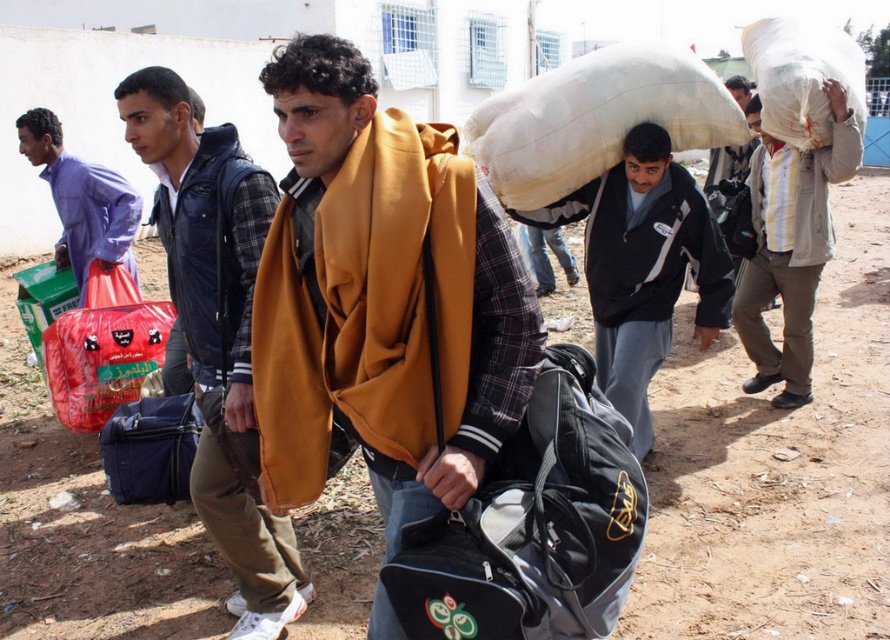
Who is higher up, black fabric bag at center or red plastic bag at center?

red plastic bag at center

Where is `black fabric bag at center`? This screenshot has width=890, height=640. black fabric bag at center is located at coordinates (534, 525).

Locate an element on the screen. The image size is (890, 640). black fabric bag at center is located at coordinates (534, 525).

Does matte yellow jacket at center have a lesser width compared to brushed metal bag at left?

Yes.

Between point (236, 253) and point (85, 227), which one is positioned behind?

The point (85, 227) is more distant.

This screenshot has width=890, height=640. Identify the location of matte yellow jacket at center. (217, 330).

Image resolution: width=890 pixels, height=640 pixels. Find the location of `black fabric bag at center`. black fabric bag at center is located at coordinates (534, 525).

Is point (492, 520) closer to viewer compared to point (120, 259)?

Yes, point (492, 520) is in front of point (120, 259).

Between point (565, 554) and point (58, 259), which one is positioned behind?

The point (58, 259) is behind.

The image size is (890, 640). What are the coordinates of `black fabric bag at center` in the screenshot? It's located at (534, 525).